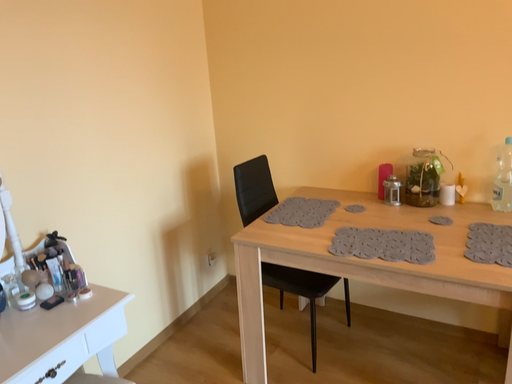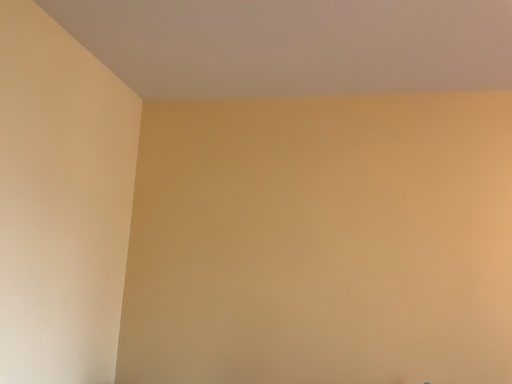
Question: How did the camera likely rotate when shooting the video?

Choices:
 (A) rotated upward
 (B) rotated downward

Answer: (A)